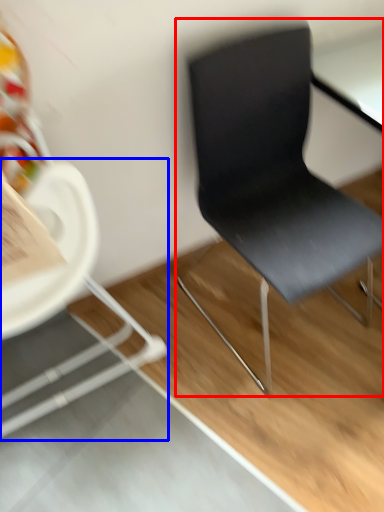
Question: Which object is closer to the camera taking this photo, chair (highlighted by a red box) or chair (highlighted by a blue box)?

Choices:
 (A) chair
 (B) chair

Answer: (B)